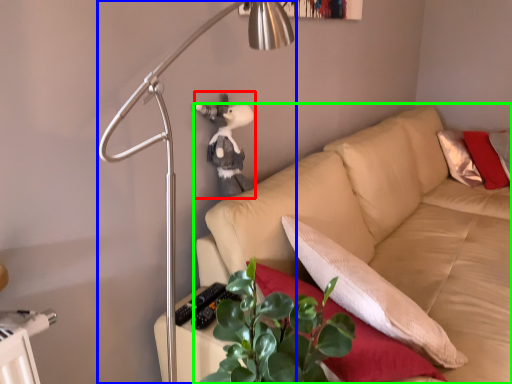
Question: Estimate the real-world distances between objects in this image. Which object is farther from figurine (highlighted by a red box), lamp (highlighted by a blue box) or studio couch (highlighted by a green box)?

Choices:
 (A) lamp
 (B) studio couch

Answer: (B)